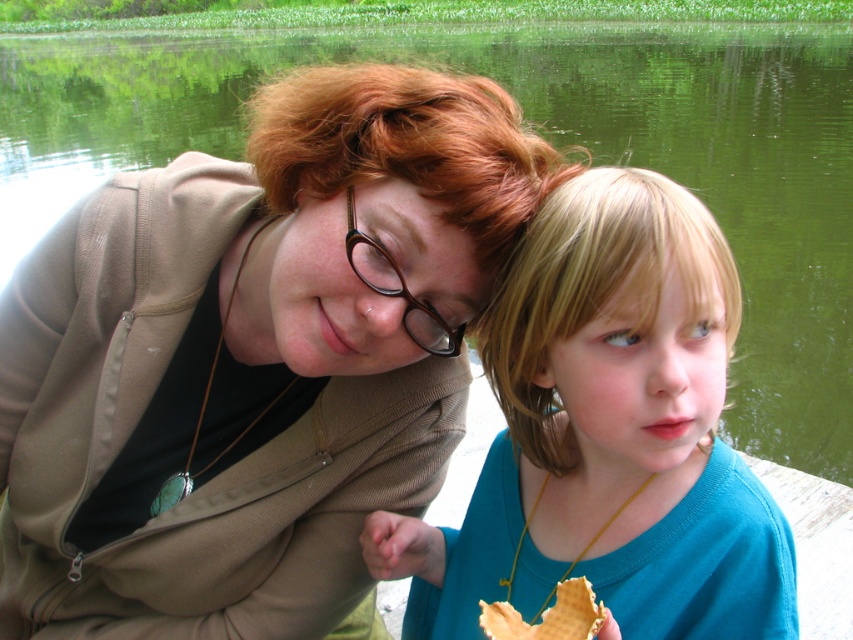
You are a photographer trying to capture a candid shot of the blue matte shirt at center and the brown plastic glasses at center. Which object is positioned nearer to your camera lens?

The blue matte shirt at center is closer to the viewer than the brown plastic glasses at center, so the blue matte shirt at center will appear nearer to the camera lens in the photo.

You are a photographer trying to capture a candid shot of the two people in the scene. You want to ensure the brown plastic glasses at center is in the frame. Based on their current positions, where should you position your camera to include both individuals and the glasses?

The brown plastic glasses at center are located at coordinates point (398, 291). To include both individuals and the glasses in the frame, position the camera such that it captures the central area where the glasses are placed, ensuring the adults and child remain within the shot.

You are a photographer taking a picture of the scene described. You notice a point at coordinates (253, 356). What object is located at that point?

The object at point (253, 356) is the matte brown jacket at center.